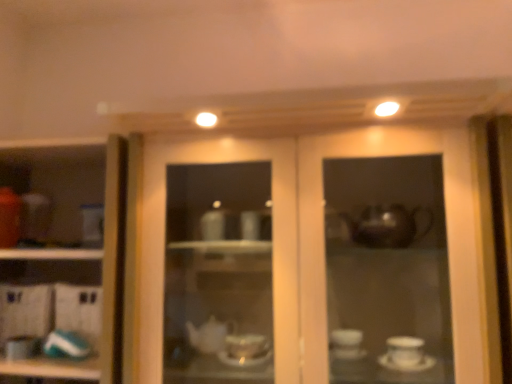
Question: Considering the relative positions of teal glossy plate at lower left, the second tableware when ordered from left to right, and matte white teapot at lower left, which ranks as the first tableware in left-to-right order, in the image provided, is teal glossy plate at lower left, the second tableware when ordered from left to right, to the right of matte white teapot at lower left, which ranks as the first tableware in left-to-right order, from the viewer's perspective?

Choices:
 (A) no
 (B) yes

Answer: (B)

Question: Is matte white teapot at lower left, the 2th tableware in the right-to-left sequence, surrounded by teal glossy plate at lower left, which appears as the first tableware when viewed from the right?

Choices:
 (A) no
 (B) yes

Answer: (A)

Question: Is teal glossy plate at lower left, which appears as the first tableware when viewed from the right, far away from matte white teapot at lower left, which ranks as the first tableware in left-to-right order?

Choices:
 (A) no
 (B) yes

Answer: (A)

Question: Is teal glossy plate at lower left, the second tableware when ordered from left to right, facing towards matte white teapot at lower left, which ranks as the first tableware in left-to-right order?

Choices:
 (A) yes
 (B) no

Answer: (B)

Question: Is teal glossy plate at lower left, the second tableware when ordered from left to right, at the left side of matte white teapot at lower left, the 2th tableware in the right-to-left sequence?

Choices:
 (A) yes
 (B) no

Answer: (B)

Question: Is teal glossy plate at lower left, which appears as the first tableware when viewed from the right, not within matte white teapot at lower left, which ranks as the first tableware in left-to-right order?

Choices:
 (A) yes
 (B) no

Answer: (A)

Question: From a real-world perspective, is teal glossy plate at lower left, the second tableware when ordered from left to right, under matte glass cabinet at center?

Choices:
 (A) no
 (B) yes

Answer: (B)

Question: Is teal glossy plate at lower left, the second tableware when ordered from left to right, bigger than matte glass cabinet at center?

Choices:
 (A) no
 (B) yes

Answer: (A)

Question: Is teal glossy plate at lower left, which appears as the first tableware when viewed from the right, positioned behind matte glass cabinet at center?

Choices:
 (A) yes
 (B) no

Answer: (A)

Question: Is teal glossy plate at lower left, the second tableware when ordered from left to right, surrounding matte glass cabinet at center?

Choices:
 (A) yes
 (B) no

Answer: (B)

Question: Is teal glossy plate at lower left, which appears as the first tableware when viewed from the right, looking in the opposite direction of matte glass cabinet at center?

Choices:
 (A) yes
 (B) no

Answer: (B)

Question: Could you tell me if teal glossy plate at lower left, which appears as the first tableware when viewed from the right, is facing matte glass cabinet at center?

Choices:
 (A) yes
 (B) no

Answer: (B)

Question: Is white glossy cup at left further to the viewer compared to matte glass cabinet at center?

Choices:
 (A) no
 (B) yes

Answer: (B)